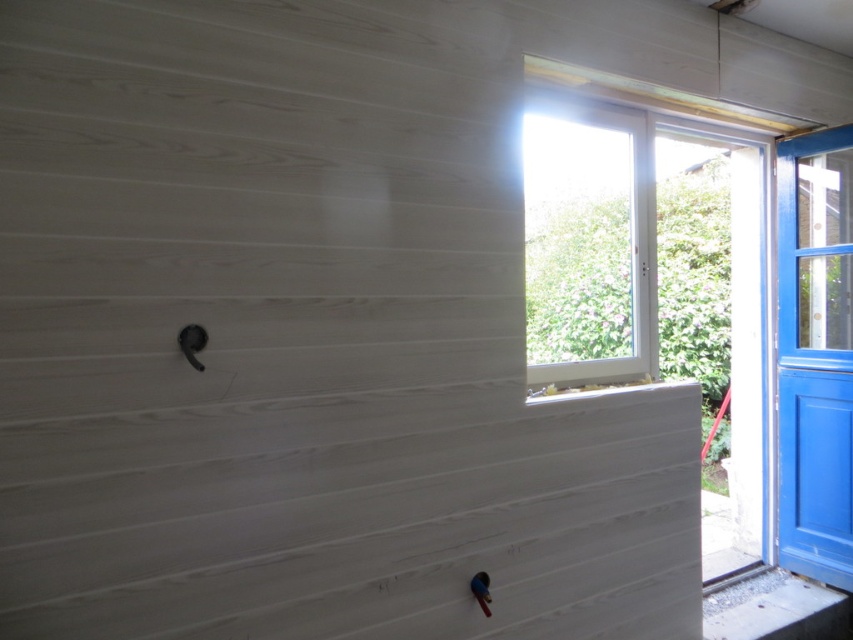
Is white plastic window at upper center below smooth concrete window sill at lower right?

Actually, white plastic window at upper center is above smooth concrete window sill at lower right.

Is white plastic window at upper center smaller than smooth concrete window sill at lower right?

No, white plastic window at upper center is not smaller than smooth concrete window sill at lower right.

Between point (527, 236) and point (802, 588), which one is positioned behind?

Positioned behind is point (802, 588).

The width and height of the screenshot is (853, 640). Identify the location of white plastic window at upper center. (587, 243).

Who is positioned more to the left, white plastic window at upper center or blue glossy door at right?

white plastic window at upper center

Can you confirm if white plastic window at upper center is positioned below blue glossy door at right?

Incorrect, white plastic window at upper center is not positioned below blue glossy door at right.

Is point (561, 192) positioned before point (792, 157)?

That is True.

Image resolution: width=853 pixels, height=640 pixels. In order to click on white plastic window at upper center in this screenshot , I will do `click(587, 243)`.

Is blue glossy door at right above smooth concrete window sill at lower right?

Yes, blue glossy door at right is above smooth concrete window sill at lower right.

You are a GUI agent. You are given a task and a screenshot of the screen. Output one action in this format:
    pyautogui.click(x=<x>, y=<y>)
    Task: Click on the blue glossy door at right
    
    Given the screenshot: What is the action you would take?
    pyautogui.click(x=815, y=355)